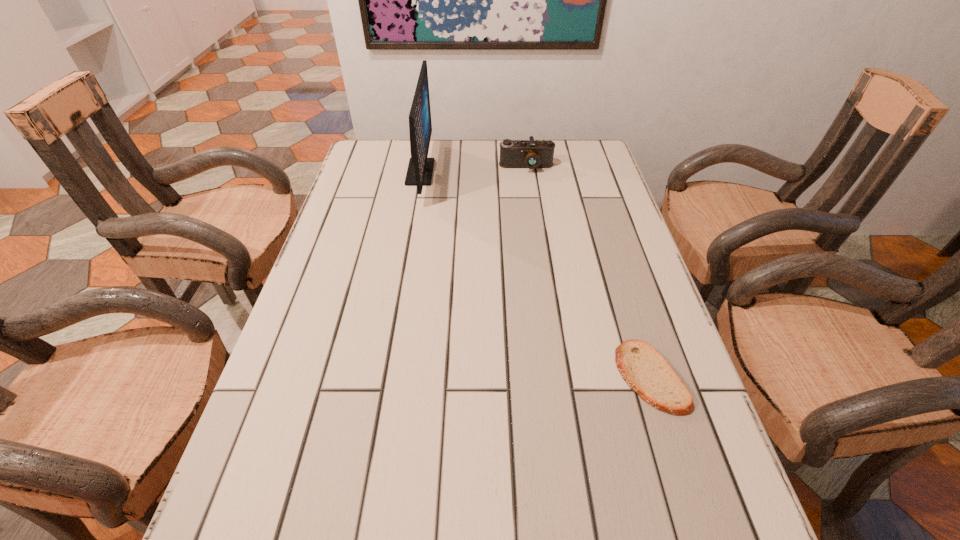
Identify the location of camera that is at the far edge. (531, 154).

This screenshot has height=540, width=960. I want to click on object located in the right edge section of the desktop, so click(643, 368).

At what (x,y) coordinates should I click in order to perform the action: click on free space at the far edge of the desktop. Please return your answer as a coordinate pair (x, y). The height and width of the screenshot is (540, 960). Looking at the image, I should click on (487, 143).

Where is `vacant space at the left edge of the desktop`? vacant space at the left edge of the desktop is located at coordinates (327, 500).

In the image, there is a desktop. Identify the location of free space at the right edge. (612, 274).

In the image, there is a desktop. At what (x,y) coordinates should I click in order to perform the action: click on vacant space at the far left corner. Please return your answer as a coordinate pair (x, y). Looking at the image, I should click on (374, 152).

In the image, there is a desktop. Find the location of `vacant space at the far right corner`. vacant space at the far right corner is located at coordinates (564, 150).

Locate an element on the screen. The width and height of the screenshot is (960, 540). empty location between the leftmost object and the camera is located at coordinates (473, 170).

Locate an element on the screen. free spot between the pita bread and the computer monitor is located at coordinates (535, 275).

Find the location of a particular element. The height and width of the screenshot is (540, 960). empty space between the leftmost object and the camera is located at coordinates (473, 170).